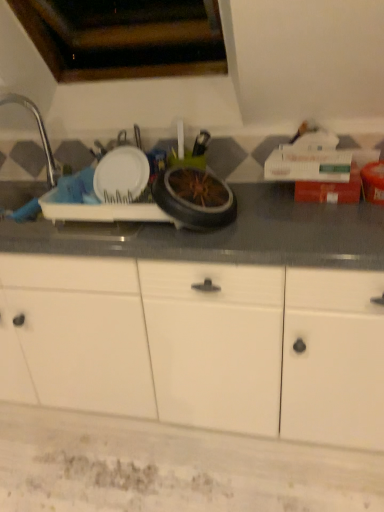
Question: From the image's perspective, is white matte cabinet at center positioned above or below silver metallic faucet at left?

Choices:
 (A) below
 (B) above

Answer: (A)

Question: Considering the relative positions of white matte cabinet at center and silver metallic faucet at left in the image provided, is white matte cabinet at center to the left or to the right of silver metallic faucet at left?

Choices:
 (A) left
 (B) right

Answer: (B)

Question: From a real-world perspective, is white matte cabinet at center positioned above or below silver metallic faucet at left?

Choices:
 (A) below
 (B) above

Answer: (A)

Question: Is silver metallic faucet at left in front of or behind white matte cabinet at center in the image?

Choices:
 (A) behind
 (B) front

Answer: (A)

Question: From their relative heights in the image, would you say silver metallic faucet at left is taller or shorter than white matte cabinet at center?

Choices:
 (A) tall
 (B) short

Answer: (B)

Question: From the image's perspective, is silver metallic faucet at left positioned above or below white matte cabinet at center?

Choices:
 (A) above
 (B) below

Answer: (A)

Question: From a real-world perspective, relative to white matte cabinet at center, is silver metallic faucet at left vertically above or below?

Choices:
 (A) below
 (B) above

Answer: (B)